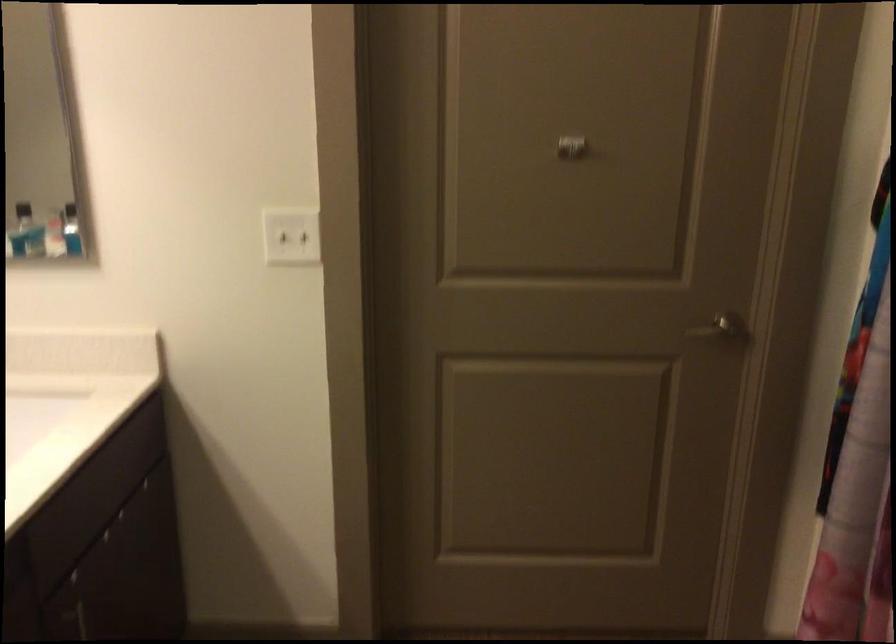
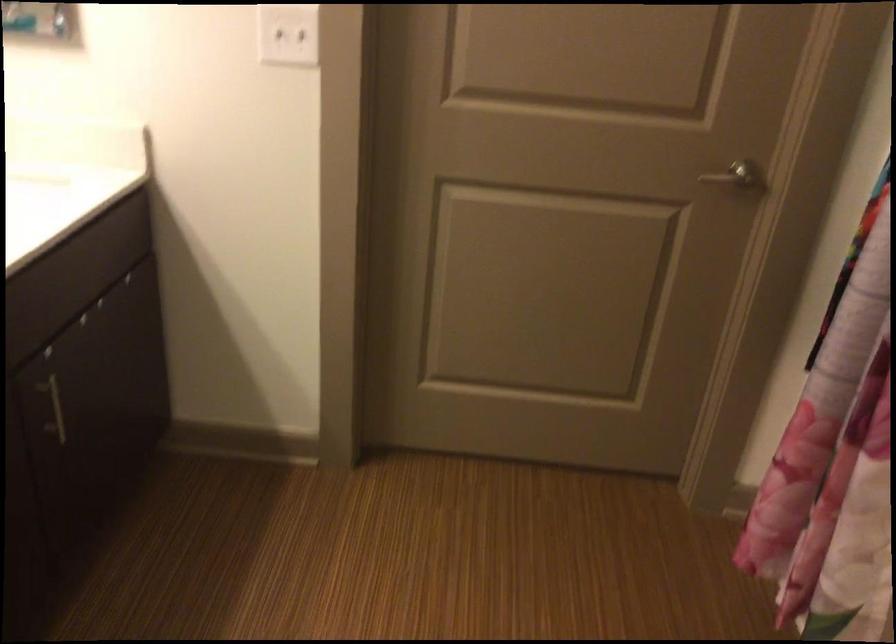
What movement of the cameraman would produce the second image?

The movement direction of the cameraman is right, forward.